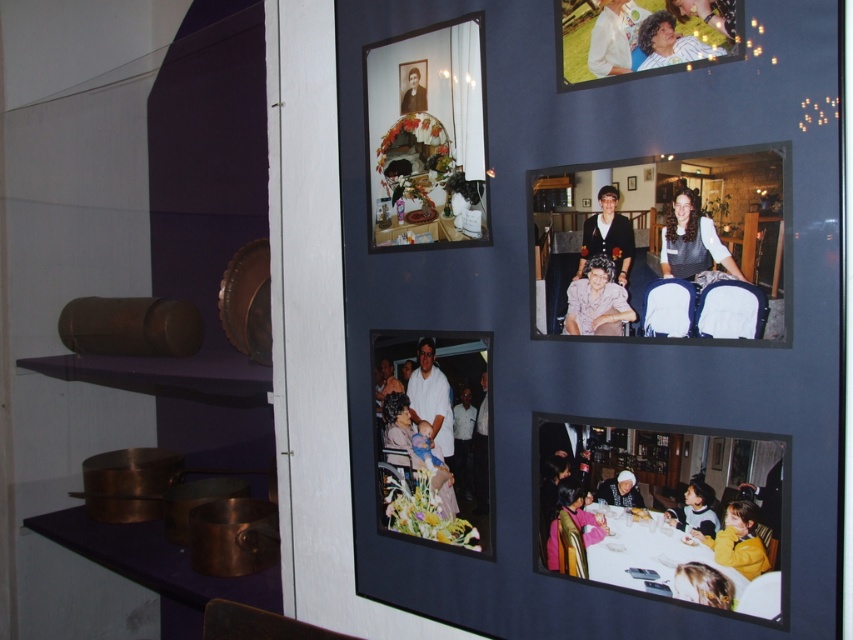
Question: Which point appears farthest from the camera in this image?

Choices:
 (A) (664, 433)
 (B) (689, 4)
 (C) (656, 60)
 (D) (618, 42)

Answer: (D)

Question: Is matte pink shirt at center further to the viewer compared to matte black hair at lower center?

Choices:
 (A) yes
 (B) no

Answer: (B)

Question: Which of the following is the closest to the observer?

Choices:
 (A) light brown hair at lower right
 (B) white glossy table at lower right
 (C) white cotton shirt at center

Answer: (B)

Question: Which is farther from the matte black photo frame at center?

Choices:
 (A) matte black dress at center
 (B) matte black portrait at upper left
 (C) light brown hair at lower right

Answer: (B)

Question: Can you confirm if matte pink shirt at center is positioned to the left of white cotton shirt at center?

Choices:
 (A) no
 (B) yes

Answer: (A)

Question: Does matte plastic photo frame at upper center lie behind matte pink shirt at center?

Choices:
 (A) yes
 (B) no

Answer: (B)